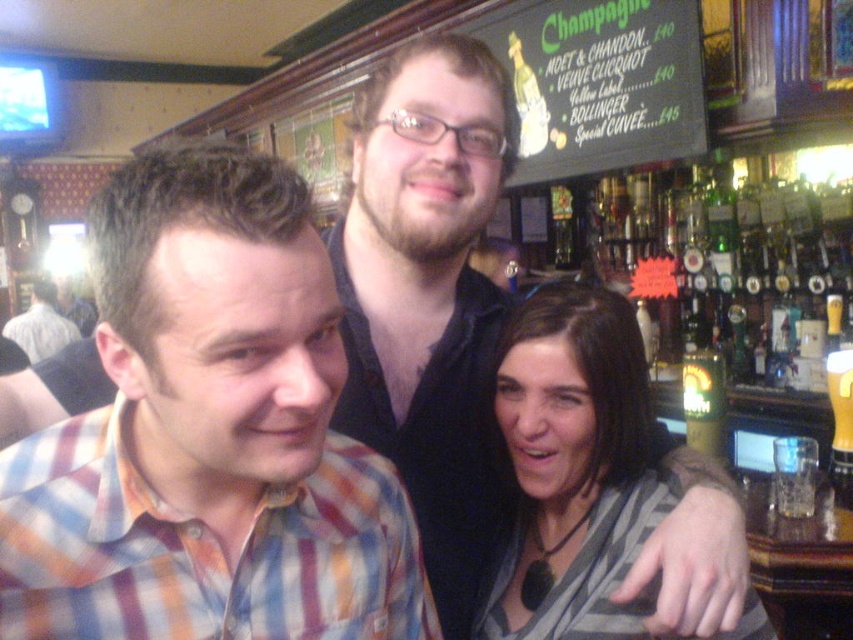
Between point (807, 240) and point (721, 451), which one is positioned in front?

Positioned in front is point (721, 451).

Who is more distant from viewer, (x=822, y=193) or (x=717, y=406)?

The point (x=822, y=193) is behind.

You are a GUI agent. You are given a task and a screenshot of the screen. Output one action in this format:
    pyautogui.click(x=<x>, y=<y>)
    Task: Click on the green glass bottle at upper right
    This screenshot has height=640, width=853.
    Given the screenshot: What is the action you would take?
    pyautogui.click(x=729, y=260)

Does gray striped scarf at center have a larger size compared to translucent glass mug at upper right?

Indeed, gray striped scarf at center has a larger size compared to translucent glass mug at upper right.

Is gray striped scarf at center taller than translucent glass mug at upper right?

Correct, gray striped scarf at center is much taller as translucent glass mug at upper right.

Who is more forward, (x=511, y=637) or (x=697, y=413)?

Positioned in front is point (x=511, y=637).

At what (x,y) coordinates should I click in order to perform the action: click on gray striped scarf at center. Please return your answer as a coordinate pair (x, y). Looking at the image, I should click on (573, 467).

Which is more to the left, green glass bottle at upper right or plaid shirt at center?

From the viewer's perspective, plaid shirt at center appears more on the left side.

Who is more forward, (822, 216) or (6, 324)?

Point (822, 216)

What do you see at coordinates (729, 260) in the screenshot?
I see `green glass bottle at upper right` at bounding box center [729, 260].

Identify the location of green glass bottle at upper right. (729, 260).